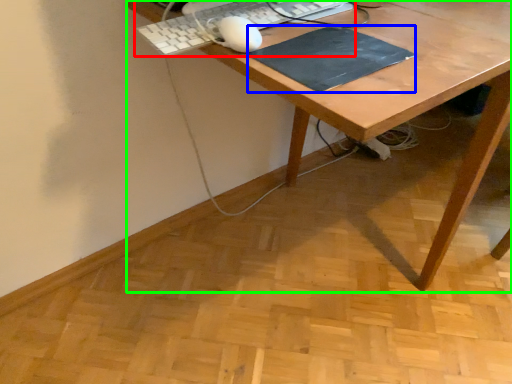
Question: Which object is the farthest from computer keyboard (highlighted by a red box)? Choose among these: mousepad (highlighted by a blue box) or desk (highlighted by a green box).

Choices:
 (A) mousepad
 (B) desk

Answer: (B)